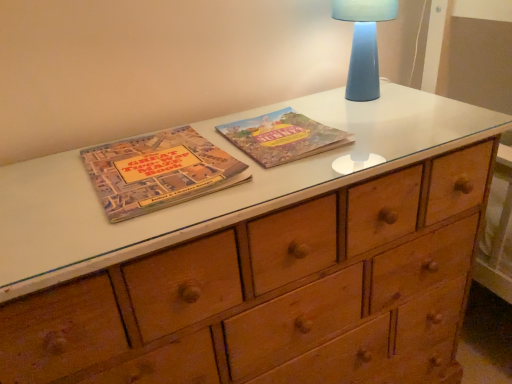
Question: Would you say blue ceramic lamp at upper right is inside or outside matte cardboard book at center-left, placed as the 1th paperback book when sorted from left to right?

Choices:
 (A) outside
 (B) inside

Answer: (A)

Question: Is point (391, 3) positioned closer to the camera than point (245, 182)?

Choices:
 (A) farther
 (B) closer

Answer: (A)

Question: Based on their relative distances, which object is nearer to the matte cardboard book at center-left, placed as the 1th paperback book when sorted from left to right?

Choices:
 (A) matte paper book at center, which appears as the 2th paperback book when viewed from the left
 (B) blue ceramic lamp at upper right

Answer: (A)

Question: Considering the real-world distances, which object is closest to the blue ceramic lamp at upper right?

Choices:
 (A) matte paper book at center, the first paperback book from the right
 (B) matte cardboard book at center-left, the second paperback book viewed from the right

Answer: (A)